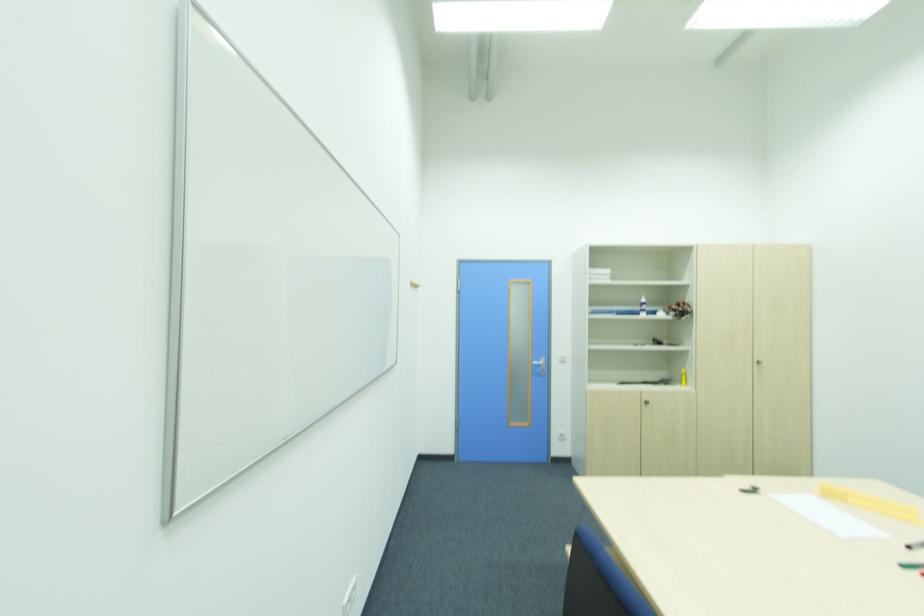
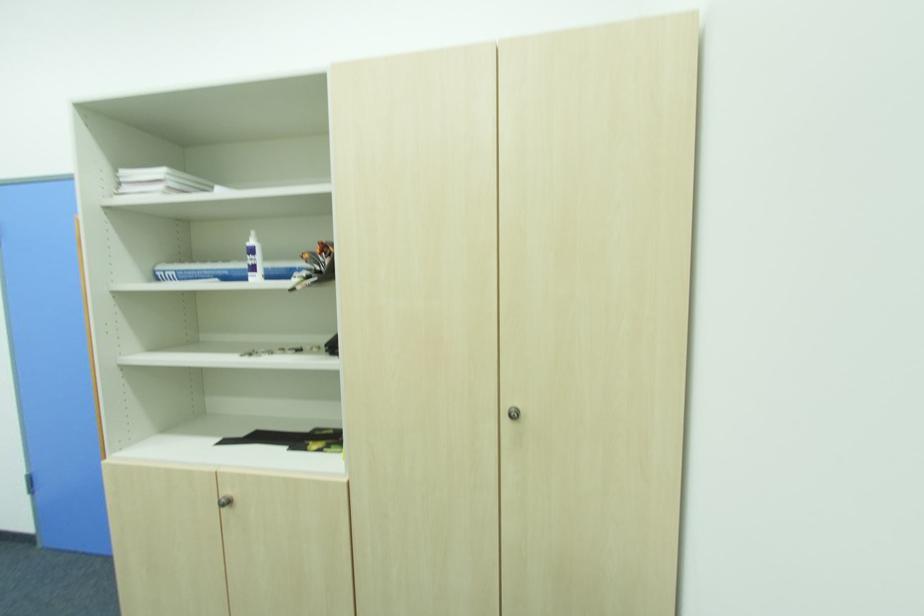
Where in the second image is the point corresponding to [647,301] from the first image?

(254, 243)